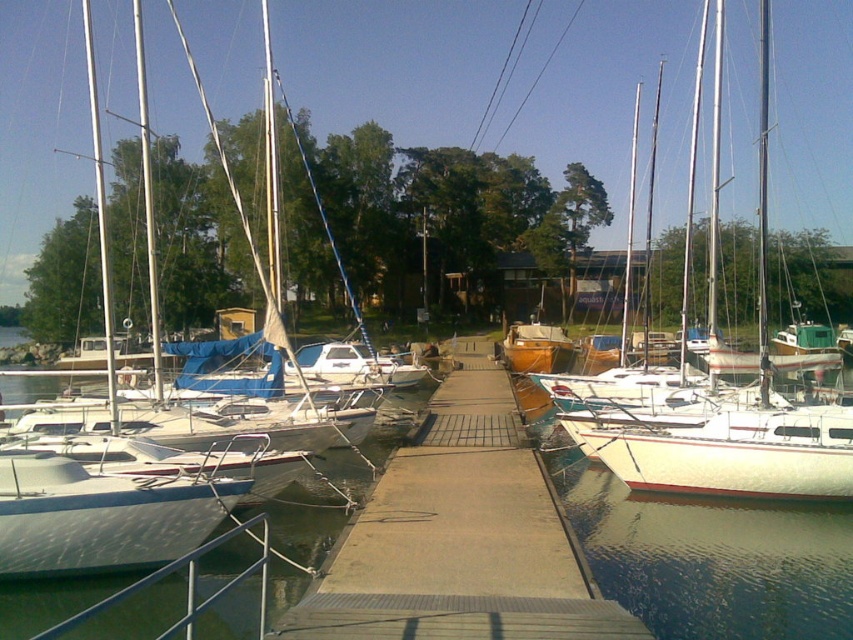
You are standing on the smooth concrete dock at center and want to look towards the clear water at dock center. Which direction should you turn your head?

The clear water at dock center is to the left of smooth concrete dock at center, so you should turn your head to the left to look towards the clear water at dock center.

You are a dock inspector checking the marina. You need to ensure that the clear water at dock center and the smooth concrete dock at center meet safety standards. According to the measurements, which one has a greater width?

The clear water at dock center has a greater width than the smooth concrete dock at center.

You are standing at the edge of the marina walkway and see two points marked in the scene. Which point is closer to you, point (846, 588) or point (503, 508)?

Point (846, 588) is closer to you because it is in front of point (503, 508).